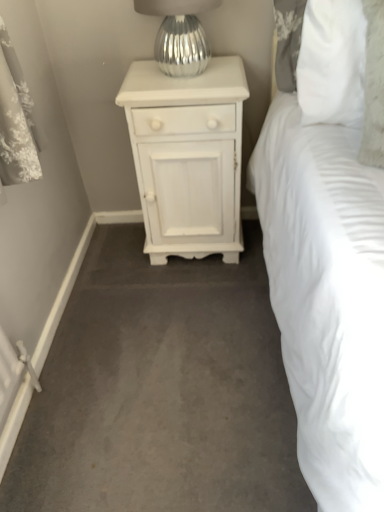
Question: Looking at the image, does white painted wood nightstand at center seem bigger or smaller compared to silver metallic vase at upper center?

Choices:
 (A) small
 (B) big

Answer: (B)

Question: Visually, is white painted wood nightstand at center positioned to the left or to the right of silver metallic vase at upper center?

Choices:
 (A) left
 (B) right

Answer: (B)

Question: Considering the real-world distances, which object is closest to the smooth gray carpet at center?

Choices:
 (A) white painted wood nightstand at center
 (B) silver metallic vase at upper center

Answer: (A)

Question: Which of these objects is positioned closest to the silver metallic vase at upper center?

Choices:
 (A) smooth gray carpet at center
 (B) white painted wood nightstand at center

Answer: (B)